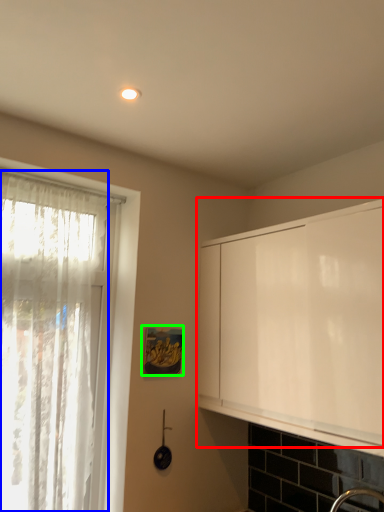
Question: Considering the real-world distances, which object is farthest from cabinetry (highlighted by a red box)? curtain (highlighted by a blue box) or picture frame (highlighted by a green box)?

Choices:
 (A) curtain
 (B) picture frame

Answer: (A)